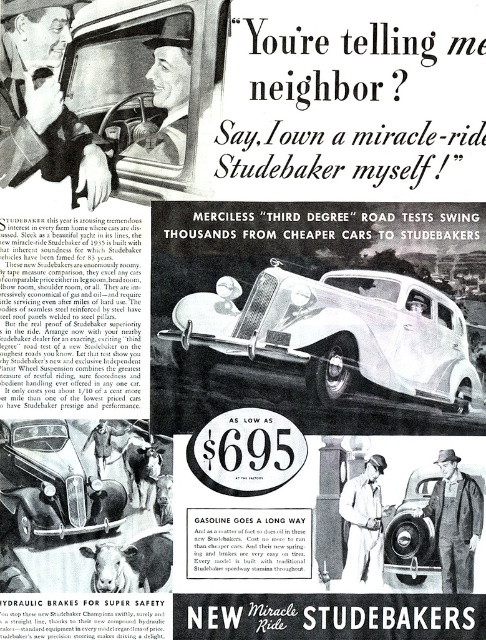
Question: Which object is closer to the camera taking this photo?

Choices:
 (A) shiny silver car at lower left
 (B) silver metallic sedan at center

Answer: (A)

Question: Is smooth leather glove at upper left in front of matte black hat at upper center?

Choices:
 (A) yes
 (B) no

Answer: (A)

Question: Is shiny silver car at lower left below white coat at center?

Choices:
 (A) no
 (B) yes

Answer: (A)

Question: Among these points, which one is nearest to the camera?

Choices:
 (A) (369, 464)
 (B) (82, 186)
 (C) (471, 570)
 (D) (272, 282)

Answer: (D)

Question: Is overalls at lower right to the right of white coat at center from the viewer's perspective?

Choices:
 (A) yes
 (B) no

Answer: (A)

Question: Which point is farther to the camera?

Choices:
 (A) shiny silver car at lower left
 (B) matte black hat at upper center

Answer: (B)